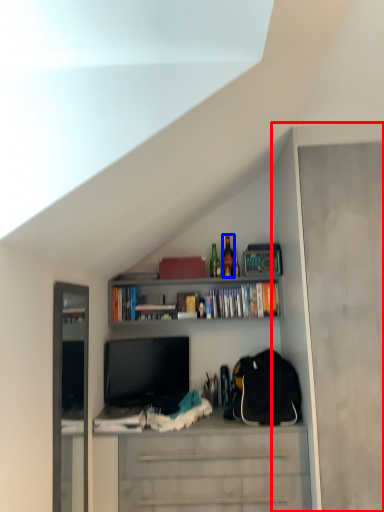
Question: Which object appears closest to the camera in this image, cabinet (highlighted by a red box) or bottle (highlighted by a blue box)?

Choices:
 (A) cabinet
 (B) bottle

Answer: (A)